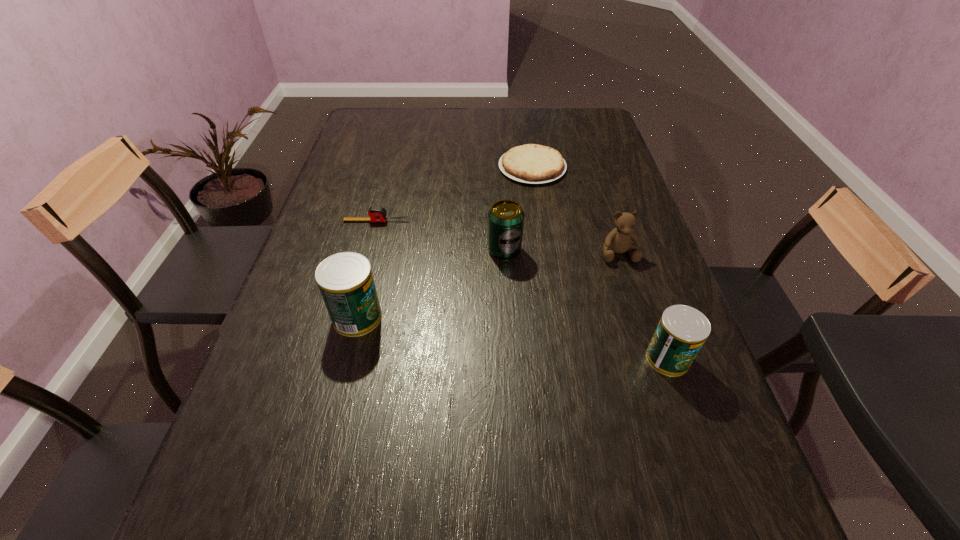
This screenshot has width=960, height=540. I want to click on free space between the shorter can and the left can, so click(x=513, y=338).

At what (x,y) coordinates should I click in order to perform the action: click on free space between the tape measure and the shorter can. Please return your answer as a coordinate pair (x, y). Looking at the image, I should click on (522, 290).

You are a GUI agent. You are given a task and a screenshot of the screen. Output one action in this format:
    pyautogui.click(x=<x>, y=<y>)
    Task: Click on the vacant point located between the teddy bear and the shortest object
    The width and height of the screenshot is (960, 540).
    Given the screenshot: What is the action you would take?
    pyautogui.click(x=575, y=210)

Where is `free space between the right can and the farther can`? free space between the right can and the farther can is located at coordinates (513, 338).

The image size is (960, 540). Find the location of `vacant space in between the nearer can and the beer can`. vacant space in between the nearer can and the beer can is located at coordinates (586, 304).

Identify which object is the third nearest to the teddy bear. Please provide its 2D coordinates. Your answer should be formatted as a tuple, i.e. [(x, y)], where the tuple contains the x and y coordinates of a point satisfying the conditions above.

[(535, 164)]

Select which object appears as the fifth closest to the teddy bear. Please provide its 2D coordinates. Your answer should be formatted as a tuple, i.e. [(x, y)], where the tuple contains the x and y coordinates of a point satisfying the conditions above.

[(345, 280)]